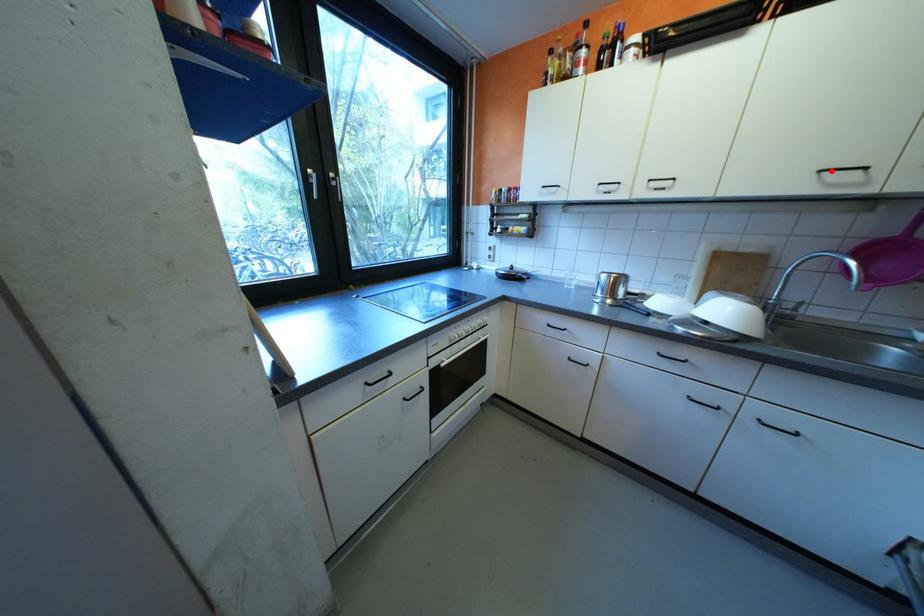
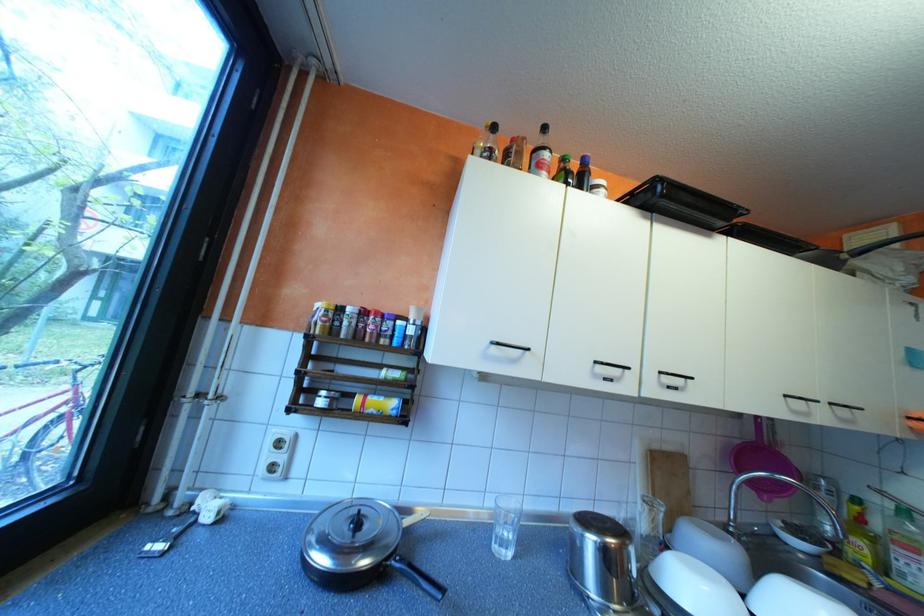
Where in the second image is the point corresponding to the highlighted location from the first image?

(797, 395)